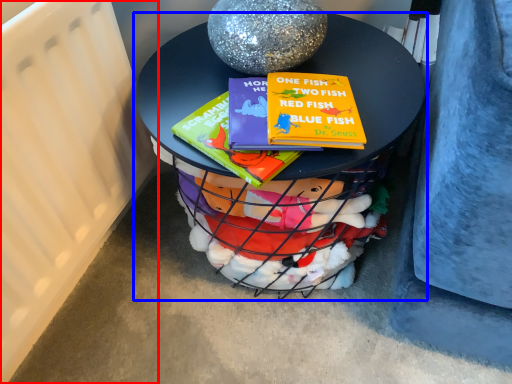
Question: Which of the following is the closest to the observer, radiator (highlighted by a red box) or table (highlighted by a blue box)?

Choices:
 (A) radiator
 (B) table

Answer: (A)